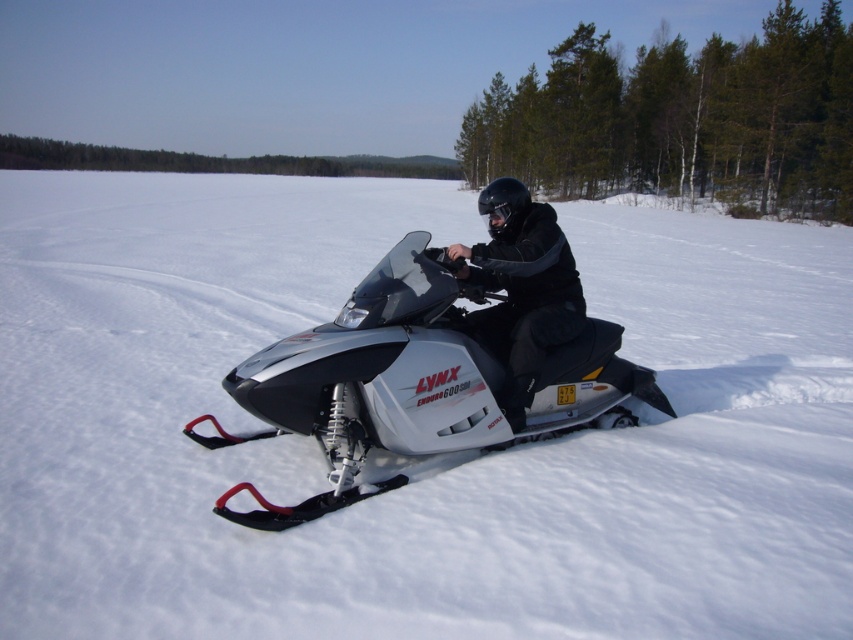
Question: Which object is farther from the camera taking this photo?

Choices:
 (A) white powdery snow at center
 (B) silver metallic snowmobile at center

Answer: (B)

Question: Can you confirm if white powdery snow at center is thinner than silver metallic snowmobile at center?

Choices:
 (A) no
 (B) yes

Answer: (A)

Question: Is white powdery snow at center to the right of black matte jacket at center from the viewer's perspective?

Choices:
 (A) no
 (B) yes

Answer: (B)

Question: Can you confirm if white powdery snow at center is positioned below black matte jacket at center?

Choices:
 (A) no
 (B) yes

Answer: (A)

Question: Which object is farther from the camera taking this photo?

Choices:
 (A) silver metallic snowmobile at center
 (B) black matte jacket at center
 (C) white powdery snow at center

Answer: (B)

Question: Which of these objects is positioned closest to the white powdery snow at center?

Choices:
 (A) silver metallic snowmobile at center
 (B) black matte jacket at center

Answer: (A)